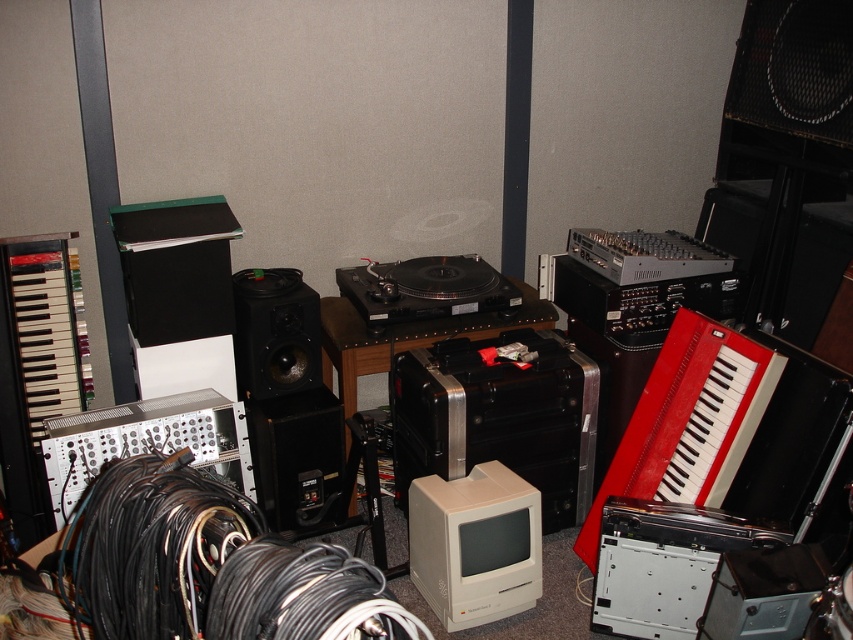
Question: Is black rubber wires at lower center wider than red leather accordion at right?

Choices:
 (A) no
 (B) yes

Answer: (B)

Question: Does white matte accordion at left appear on the right side of black matte speaker at center?

Choices:
 (A) yes
 (B) no

Answer: (B)

Question: Which object appears farthest from the camera in this image?

Choices:
 (A) black matte speaker at center
 (B) silver metallic modular synthesizer at lower left
 (C) black matte speaker at center-left

Answer: (C)

Question: Which of the following is the closest to the observer?

Choices:
 (A) black matte speaker at center-left
 (B) red leather accordion at right
 (C) black matte speaker at center
 (D) silver metallic modular synthesizer at lower left

Answer: (B)

Question: Estimate the real-world distances between objects in this image. Which object is farther from the black matte speaker at center-left?

Choices:
 (A) white matte accordion at left
 (B) silver metallic modular synthesizer at lower left
 (C) red leather accordion at right
 (D) black rubber wires at lower center

Answer: (D)

Question: Can you confirm if black rubber wires at lower center is positioned below red leather accordion at right?

Choices:
 (A) yes
 (B) no

Answer: (B)